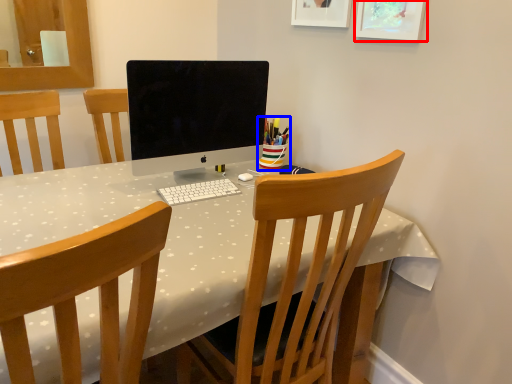
Question: Which object is closer to the camera taking this photo, picture frame (highlighted by a red box) or stationery (highlighted by a blue box)?

Choices:
 (A) picture frame
 (B) stationery

Answer: (A)